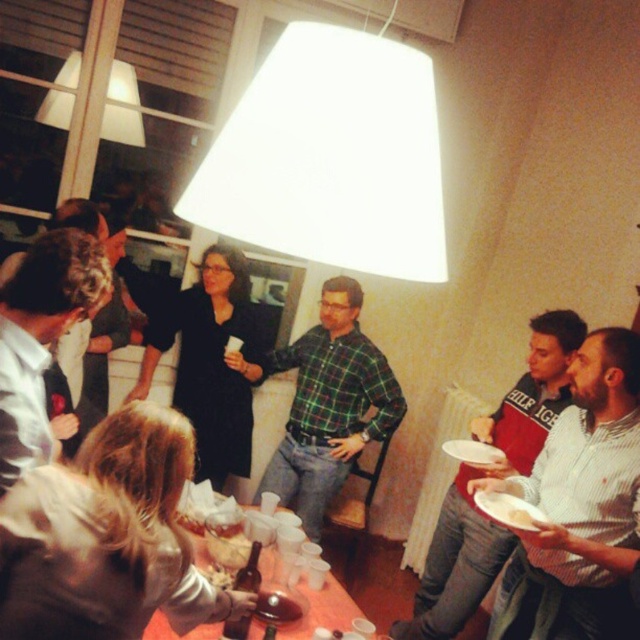
You are standing in the room and want to turn off the light. You see the white matte lampshade at upper center and the striped cotton shirt at lower right. Which object is closer to the ceiling?

The white matte lampshade at upper center is closer to the ceiling because it is above the striped cotton shirt at lower right.

You are hosting a dinner party and need to arrange the matte black plate at center and the translucent plastic cups at lower center on the table. Given their sizes, which item should you place first to ensure proper placement?

The matte black plate at center should be placed first since it is larger than the translucent plastic cups at lower center, allowing you to position the cups around it appropriately.

You are at a party and want to pick up your white striped shirt at lower right. There is another striped cotton shirt at lower right in the way. Can you reach your shirt without moving the other shirt?

The white striped shirt at lower right is in front of the striped cotton shirt at lower right, so you can reach it without moving the other shirt.